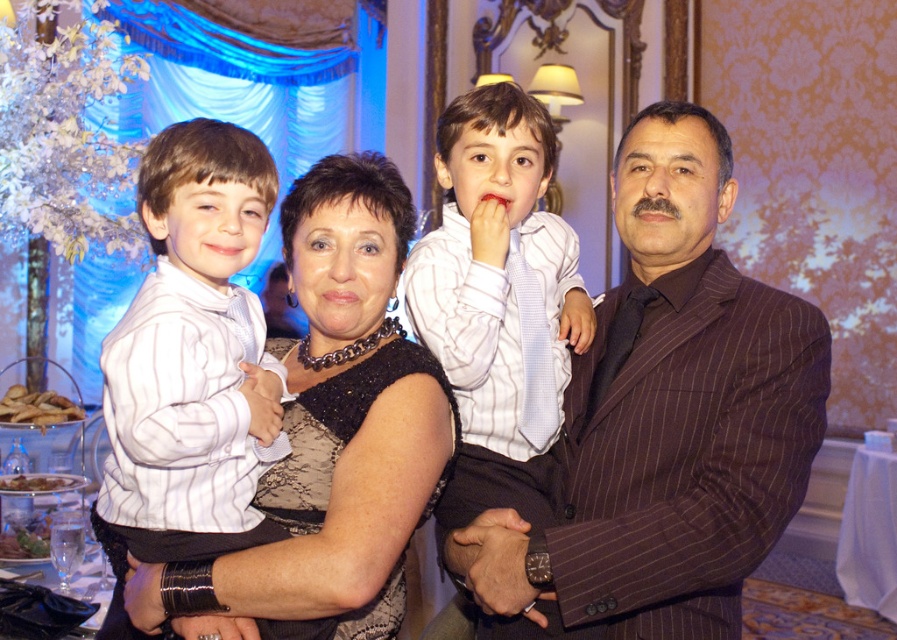
You are a photographer setting up for a group photo. You need to ensure that all participants fit within the camera frame. The camera has a width capacity of 1.8 meters. The brown pinstripe suit at center and the white striped shirt at left are the widest participants. Can both fit side by side within the frame?

The brown pinstripe suit at center is wider than the white striped shirt at left. Combined, their total width exceeds the camera frame capacity of 1.8 meters, so they cannot fit side by side.

You are standing in the center of the image. There is a point marked at coordinates [666,419]. What object is located at that point?

The point at coordinates [666,419] indicates the brown pinstripe suit at center.